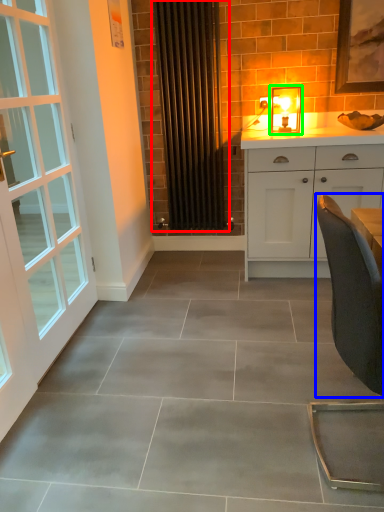
Question: Considering the real-world distances, which object is closest to radiator (highlighted by a red box)? chair (highlighted by a blue box) or light fixture (highlighted by a green box).

Choices:
 (A) chair
 (B) light fixture

Answer: (B)